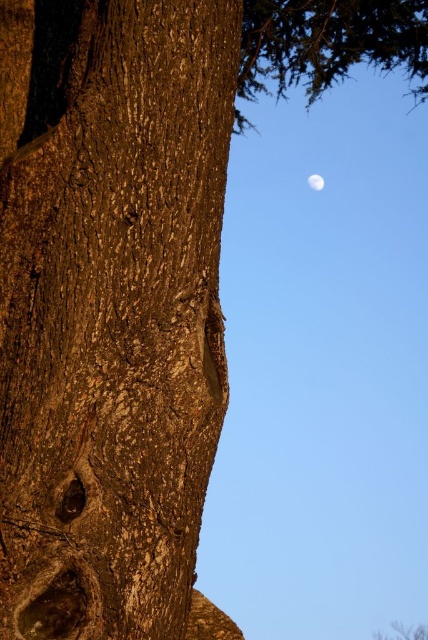
Question: Which of the following is the closest to the observer?

Choices:
 (A) (21, 634)
 (B) (314, 179)

Answer: (A)

Question: Estimate the real-world distances between objects in this image. Which object is closer to the rough bark tree trunk at left?

Choices:
 (A) rough bark tree at upper left
 (B) white matte moon at upper right

Answer: (B)

Question: Estimate the real-world distances between objects in this image. Which object is closer to the rough bark tree at upper left?

Choices:
 (A) white matte moon at upper right
 (B) rough bark tree trunk at left

Answer: (A)

Question: Is rough bark tree at upper left bigger than white matte moon at upper right?

Choices:
 (A) no
 (B) yes

Answer: (B)

Question: Does rough bark tree trunk at left have a greater width compared to white matte moon at upper right?

Choices:
 (A) no
 (B) yes

Answer: (B)

Question: Does rough bark tree at upper left appear over white matte moon at upper right?

Choices:
 (A) no
 (B) yes

Answer: (A)